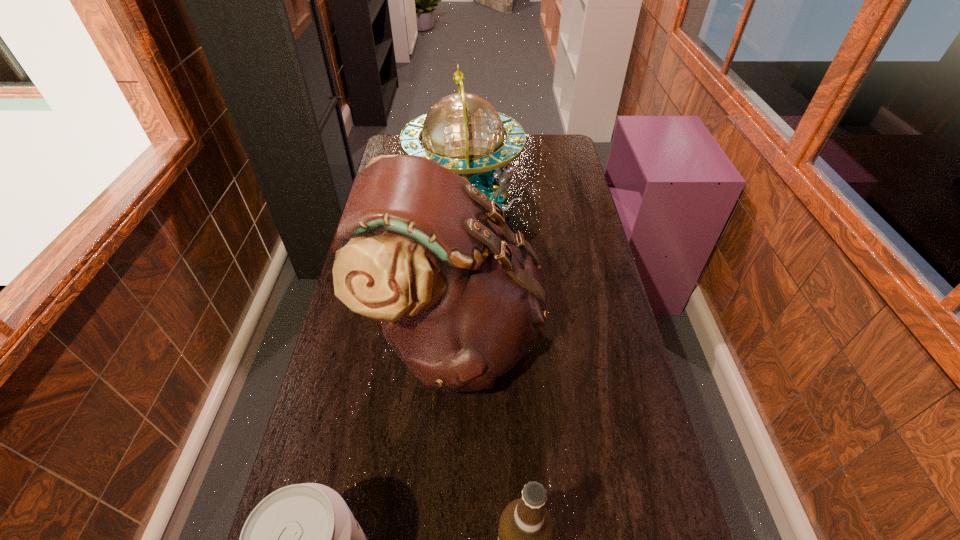
Where is `satchel`? This screenshot has width=960, height=540. satchel is located at coordinates (460, 300).

Where is `globe`? globe is located at coordinates (463, 132).

Where is `the farthest object`? the farthest object is located at coordinates (463, 132).

Where is `vacant position located at the front of the second farthest object with buckles`? This screenshot has height=540, width=960. vacant position located at the front of the second farthest object with buckles is located at coordinates (571, 334).

Find the location of a particular element. Image resolution: width=960 pixels, height=540 pixels. blank space located on the back of the farthest object is located at coordinates (468, 140).

This screenshot has width=960, height=540. What are the coordinates of `satchel that is at the left edge` in the screenshot? It's located at (460, 300).

Identify the location of globe at the left edge. The image size is (960, 540). (463, 132).

The height and width of the screenshot is (540, 960). Find the location of `vacant region at the left edge of the desktop`. vacant region at the left edge of the desktop is located at coordinates (358, 421).

Find the location of `vacant space at the right edge`. vacant space at the right edge is located at coordinates (553, 173).

In the image, there is a desktop. Where is `blank space at the far left corner`? This screenshot has width=960, height=540. blank space at the far left corner is located at coordinates (399, 150).